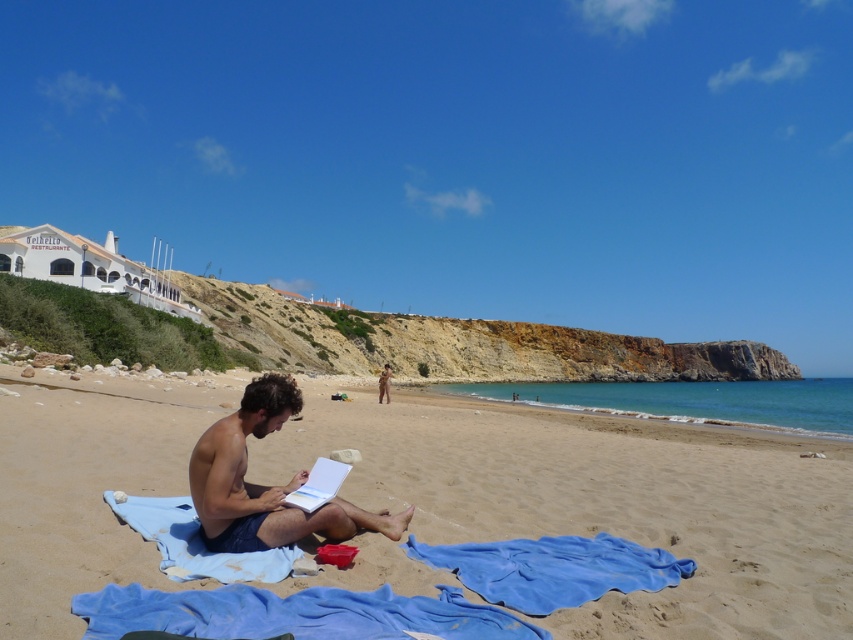
Where is `sandy beach at center`? Image resolution: width=853 pixels, height=640 pixels. sandy beach at center is located at coordinates (606, 502).

Is sandy beach at center to the left of blue fabric at lower center from the viewer's perspective?

No, sandy beach at center is not to the left of blue fabric at lower center.

Which is in front, point (0, 410) or point (465, 604)?

Point (465, 604)

Where is `sandy beach at center`? This screenshot has height=640, width=853. sandy beach at center is located at coordinates 606,502.

Who is positioned more to the right, blue fabric towel at center or nude human at center?

Positioned to the right is blue fabric towel at center.

Does blue fabric towel at center have a greater width compared to nude human at center?

Incorrect, blue fabric towel at center's width does not surpass nude human at center's.

You are a GUI agent. You are given a task and a screenshot of the screen. Output one action in this format:
    pyautogui.click(x=<x>, y=<y>)
    Task: Click on the blue fabric towel at center
    The image size is (853, 640).
    Given the screenshot: What is the action you would take?
    pyautogui.click(x=195, y=541)

Is point (643, 580) positioned in front of point (379, 378)?

Yes, point (643, 580) is in front of point (379, 378).

Between blue soft towel at lower center and nude human at center, which one appears on the right side from the viewer's perspective?

blue soft towel at lower center

Between point (425, 557) and point (384, 378), which one is positioned behind?

The point (384, 378) is behind.

Locate an element on the screen. blue soft towel at lower center is located at coordinates (553, 568).